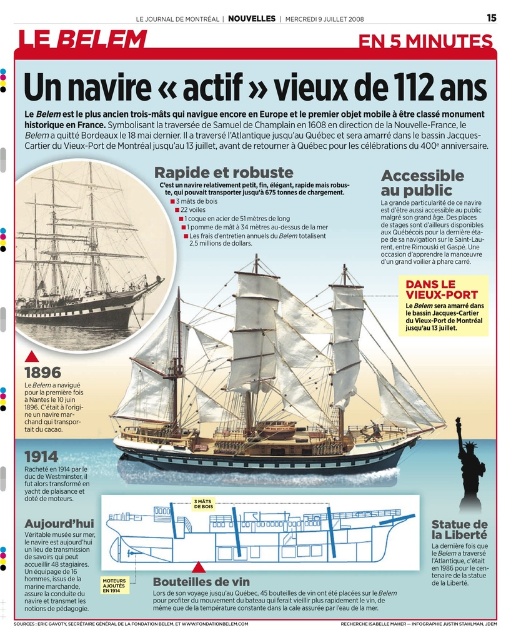
Can you confirm if wooden ship at center is thinner than rustic wood ship at center?

Incorrect, wooden ship at center's width is not less than rustic wood ship at center's.

Is wooden ship at center positioned behind rustic wood ship at center?

That is False.

What do you see at coordinates (270, 390) in the screenshot? The width and height of the screenshot is (521, 640). I see `wooden ship at center` at bounding box center [270, 390].

This screenshot has width=521, height=640. I want to click on wooden ship at center, so click(x=270, y=390).